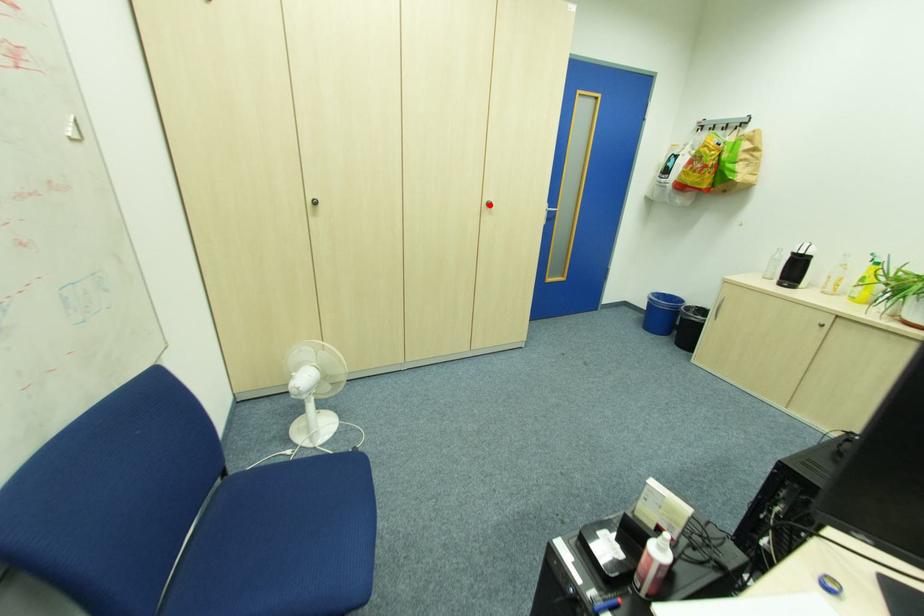
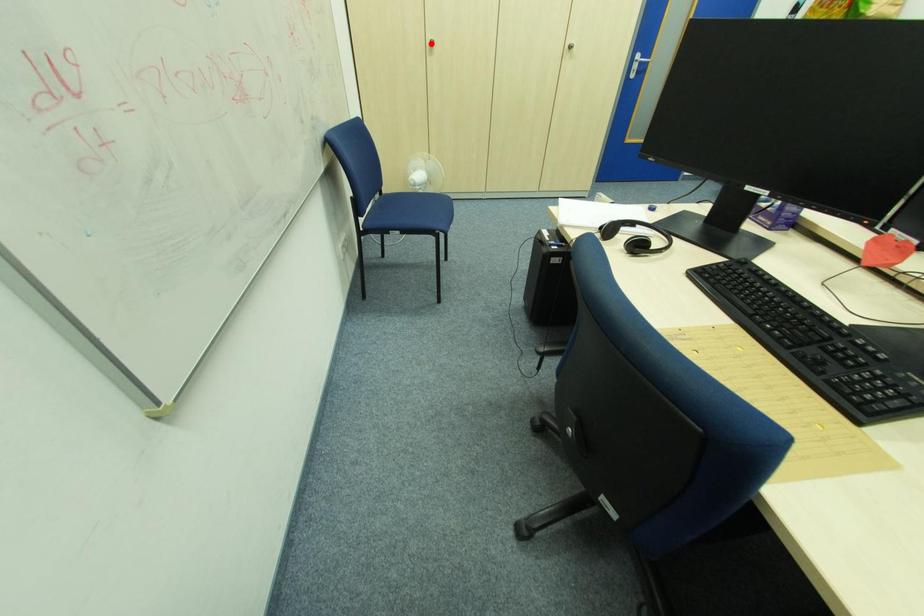
I am providing you with two images of the same scene from different viewpoints. A red point is marked on the first image and another point is marked on the second image. Is the marked point in image1 the same physical position as the marked point in image2?

No